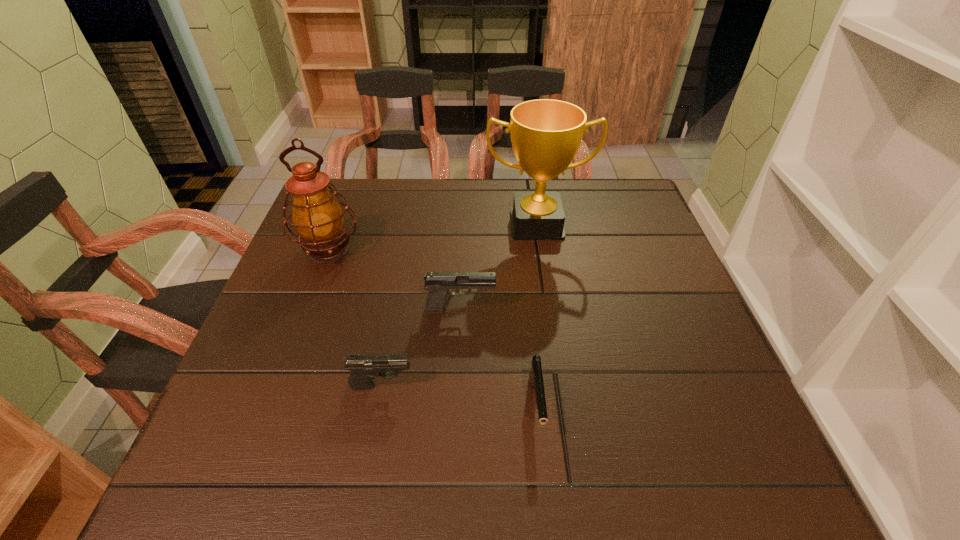
Identify which pistol is the nearest to the award. Please provide its 2D coordinates. Your answer should be formatted as a tuple, i.e. [(x, y)], where the tuple contains the x and y coordinates of a point satisfying the conditions above.

[(438, 284)]

Locate an element on the screen. pistol that can be found as the second closest to the second pistol from left to right is located at coordinates (535, 377).

Locate an element on the screen. vacant space that satisfies the following two spatial constraints: 1. on the front-facing side of the award; 2. at the barrel of the fourth object from right to left is located at coordinates (561, 385).

At what (x,y) coordinates should I click in order to perform the action: click on free point that satisfies the following two spatial constraints: 1. on the front-facing side of the award; 2. at the barrel of the fourth object from right to left. Please return your answer as a coordinate pair (x, y). Looking at the image, I should click on (561, 385).